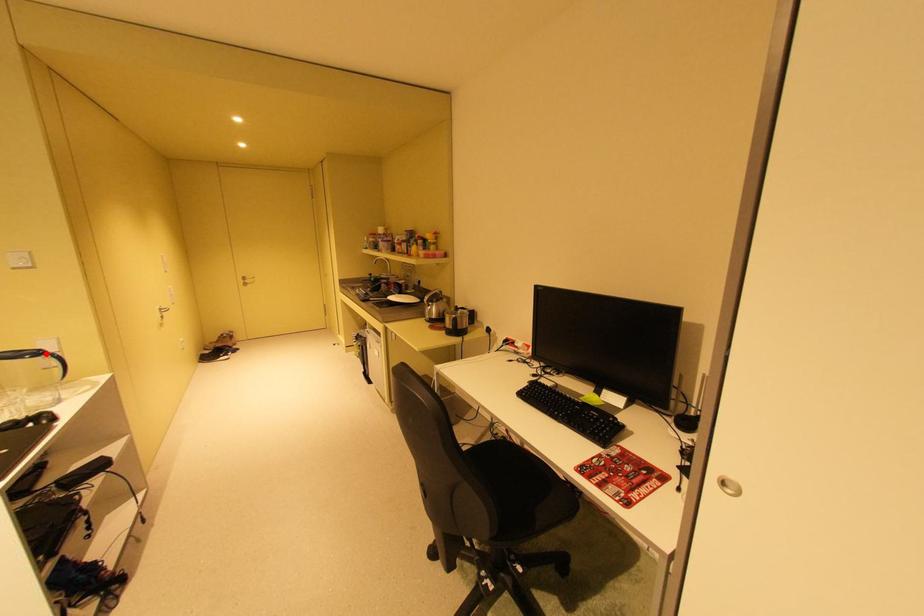
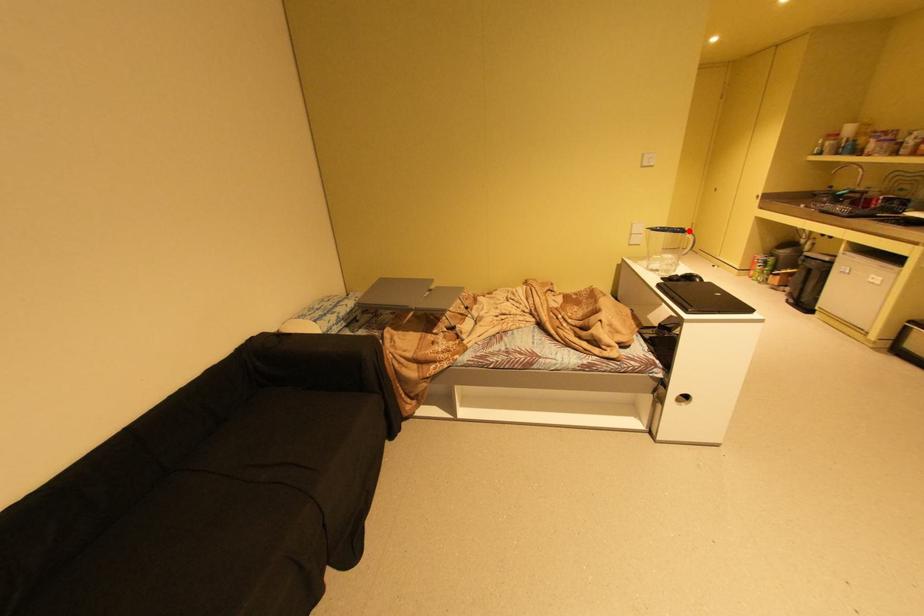
I am providing you with two images of the same scene from different viewpoints. A red point is marked on the first image and another point is marked on the second image. Does the point marked in image1 correspond to the same location as the one in image2?

Yes